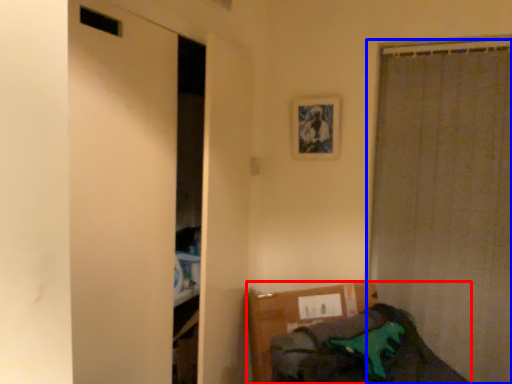
Question: Which point is further to the camera, furniture (highlighted by a red box) or curtain (highlighted by a blue box)?

Choices:
 (A) furniture
 (B) curtain

Answer: (B)